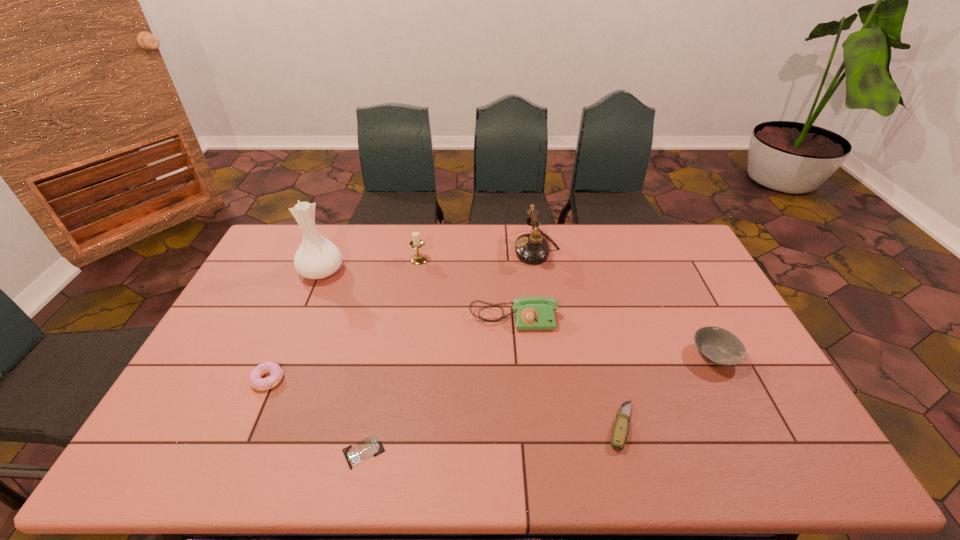
Where is `free space that is in between the identity card and the bowl`? The height and width of the screenshot is (540, 960). free space that is in between the identity card and the bowl is located at coordinates (539, 404).

In order to click on vacant space that is in between the shortest object and the doughnut in this screenshot , I will do `click(316, 416)`.

The width and height of the screenshot is (960, 540). I want to click on blank region between the pocketknife and the shorter telephone, so click(x=567, y=373).

Point out which object is positioned as the second nearest to the rightmost object. Please provide its 2D coordinates. Your answer should be formatted as a tuple, i.e. [(x, y)], where the tuple contains the x and y coordinates of a point satisfying the conditions above.

[(531, 313)]

At what (x,y) coordinates should I click in order to perform the action: click on object that is the seventh closest to the third shortest object. Please return your answer as a coordinate pair (x, y). Looking at the image, I should click on (718, 346).

At what (x,y) coordinates should I click in order to perform the action: click on free space that satisfies the following two spatial constraints: 1. on the back side of the rightmost object; 2. on the right side of the sixth tallest object. Please return your answer as a coordinate pair (x, y). The height and width of the screenshot is (540, 960). Looking at the image, I should click on (277, 356).

What are the coordinates of `vacant area that satisfies the following two spatial constraints: 1. on the back side of the candle holder; 2. on the left side of the doughnut` in the screenshot? It's located at (320, 260).

Locate an element on the screen. This screenshot has height=540, width=960. vacant space that satisfies the following two spatial constraints: 1. on the back side of the identity card; 2. on the left side of the pocketknife is located at coordinates (369, 427).

You are a GUI agent. You are given a task and a screenshot of the screen. Output one action in this format:
    pyautogui.click(x=<x>, y=<y>)
    Task: Click on the vacant region that satisfies the following two spatial constraints: 1. on the dial of the fifth nearest object; 2. on the left side of the fourth shortest object
    Image resolution: width=960 pixels, height=540 pixels.
    Given the screenshot: What is the action you would take?
    pyautogui.click(x=516, y=356)

Locate an element on the screen. The image size is (960, 540). blank area in the image that satisfies the following two spatial constraints: 1. on the dial of the farther telephone; 2. on the front side of the vase is located at coordinates (540, 272).